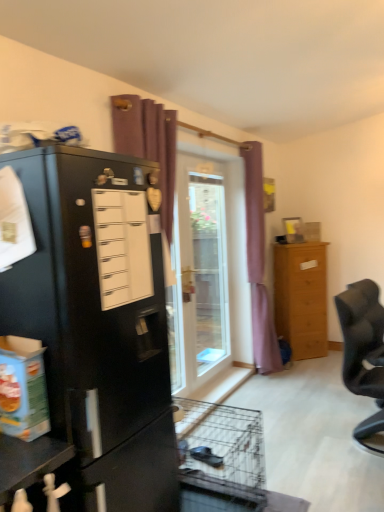
This screenshot has width=384, height=512. I want to click on light brown wooden chest of drawers at right, so click(301, 297).

Find the location of a particular element. transparent glass door at center is located at coordinates (199, 274).

The height and width of the screenshot is (512, 384). Describe the element at coordinates (122, 247) in the screenshot. I see `white matte drawer at left` at that location.

Find the location of a particular element. This screenshot has width=384, height=512. black fabric chair at right is located at coordinates (363, 351).

Describe the element at coordinates (149, 144) in the screenshot. The height and width of the screenshot is (512, 384). I see `purple fabric curtain at upper center, the second curtain when ordered from back to front` at that location.

You are a GUI agent. You are given a task and a screenshot of the screen. Output one action in this format:
    pyautogui.click(x=<x>, y=<y>)
    Task: Click on the light brown wooden chest of drawers at right
    The width and height of the screenshot is (384, 512).
    Given the screenshot: What is the action you would take?
    pyautogui.click(x=301, y=297)

I want to click on drawer in front of the black fabric chair at right, so click(122, 247).

Considering the sizes of objects white matte drawer at left and black fabric chair at right in the image provided, who is smaller, white matte drawer at left or black fabric chair at right?

white matte drawer at left.

Is white matte drawer at left inside the boundaries of black fabric chair at right, or outside?

white matte drawer at left cannot be found inside black fabric chair at right.

Between white matte drawer at left and black fabric chair at right, which one has smaller width?

white matte drawer at left is thinner.

Would you say black fabric chair at right is a long distance from white matte drawer at left?

black fabric chair at right is far away from white matte drawer at left.

Considering the relative sizes of black fabric chair at right and white matte drawer at left in the image provided, is black fabric chair at right thinner than white matte drawer at left?

No.

From the image's perspective, is black fabric chair at right located above or below white matte drawer at left?

Clearly, from the image's perspective, black fabric chair at right is below white matte drawer at left.

Who is shorter, purple fabric curtain at upper center, the 1th curtain when ordered from front to back, or black matte refrigerator at left?

black matte refrigerator at left is shorter.

Who is more distant, purple fabric curtain at upper center, the 1th curtain when ordered from front to back, or black matte refrigerator at left?

purple fabric curtain at upper center, the 1th curtain when ordered from front to back, is more distant.

From the picture: Which of these two, purple fabric curtain at upper center, the 1th curtain when ordered from front to back, or black matte refrigerator at left, is smaller?

purple fabric curtain at upper center, the 1th curtain when ordered from front to back, is smaller.

Would you say purple fabric curtain at upper center, the 1th curtain when ordered from front to back, is to the left or to the right of black fabric chair at right in the picture?

Clearly, purple fabric curtain at upper center, the 1th curtain when ordered from front to back, is on the left of black fabric chair at right in the image.

Is black fabric chair at right inside purple fabric curtain at upper center, marked as the second curtain in a right-to-left arrangement?

That's incorrect, black fabric chair at right is not inside purple fabric curtain at upper center, marked as the second curtain in a right-to-left arrangement.

Which object is further away from the camera, purple fabric curtain at upper center, which is the first curtain from left to right, or black fabric chair at right?

black fabric chair at right is behind.

From the image's perspective, starting from the black fabric chair at right, which curtain is the 1st one above? Please provide its 2D coordinates.

[(149, 144)]

Where is `cupboard lying in front of the transparent glass door at center`? cupboard lying in front of the transparent glass door at center is located at coordinates (99, 321).

Is transparent glass door at center located outside black matte refrigerator at left?

That's correct, transparent glass door at center is outside of black matte refrigerator at left.

From a real-world perspective, is transparent glass door at center over black matte refrigerator at left?

Yes, from a real-world perspective, transparent glass door at center is above black matte refrigerator at left.

Looking at their sizes, would you say transparent glass door at center is wider or thinner than black matte refrigerator at left?

Considering their sizes, transparent glass door at center looks slimmer than black matte refrigerator at left.

From the image's perspective, does purple fabric curtain at upper center, which is the first curtain from left to right, appear lower than light brown wooden chest of drawers at right?

Actually, purple fabric curtain at upper center, which is the first curtain from left to right, appears above light brown wooden chest of drawers at right in the image.

How different are the orientations of purple fabric curtain at upper center, the 1th curtain when ordered from front to back, and light brown wooden chest of drawers at right in degrees?

The angular difference between purple fabric curtain at upper center, the 1th curtain when ordered from front to back, and light brown wooden chest of drawers at right is 47.1 degrees.

Is point (170, 331) closer to viewer compared to point (292, 307)?

Yes, point (170, 331) is closer to viewer.

Is purple fabric curtain at upper center, the 1th curtain when ordered from front to back, oriented away from light brown wooden chest of drawers at right?

No, purple fabric curtain at upper center, the 1th curtain when ordered from front to back, is not facing away from light brown wooden chest of drawers at right.

Is black matte refrigerator at left facing towards transparent glass door at center?

No, black matte refrigerator at left is not aimed at transparent glass door at center.

Locate an element on the screen. door that appears above the black matte refrigerator at left (from a real-world perspective) is located at coordinates (199, 274).

In the scene shown: From the image's perspective, would you say black matte refrigerator at left is shown under transparent glass door at center?

Indeed, from the image's perspective, black matte refrigerator at left is shown beneath transparent glass door at center.

This screenshot has height=512, width=384. What are the coordinates of `drawer above the black fabric chair at right (from the image's perspective)` in the screenshot? It's located at (122, 247).

Identify the location of drawer above the black fabric chair at right (from a real-world perspective). (122, 247).

When comparing their distances from light brown wooden chest of drawers at right, does black fabric chair at right or white matte drawer at left seem closer?

The object closer to light brown wooden chest of drawers at right is black fabric chair at right.

Looking at the image, which one is located further to light brown wooden chest of drawers at right, white matte drawer at left or purple fabric curtain at center, which is the first curtain in back-to-front order?

Based on the image, white matte drawer at left appears to be further to light brown wooden chest of drawers at right.

Which object lies nearer to the anchor point black fabric chair at right, black matte refrigerator at left or purple fabric curtain at upper center, the 1th curtain when ordered from front to back?

The object closer to black fabric chair at right is purple fabric curtain at upper center, the 1th curtain when ordered from front to back.

Estimate the real-world distances between objects in this image. Which object is further from purple fabric curtain at upper center, the second curtain when ordered from back to front, white matte drawer at left or purple fabric curtain at center, marked as the second curtain in a left-to-right arrangement?

The object further to purple fabric curtain at upper center, the second curtain when ordered from back to front, is purple fabric curtain at center, marked as the second curtain in a left-to-right arrangement.

When comparing their distances from light brown wooden chest of drawers at right, does black fabric chair at right or purple fabric curtain at upper center, marked as the second curtain in a right-to-left arrangement, seem closer?

The object closer to light brown wooden chest of drawers at right is black fabric chair at right.

Estimate the real-world distances between objects in this image. Which object is further from black fabric chair at right, light brown wooden chest of drawers at right or white matte drawer at left?

Among the two, white matte drawer at left is located further to black fabric chair at right.

Looking at the image, which one is located further to purple fabric curtain at upper center, the 1th curtain when ordered from front to back, white matte drawer at left or light brown wooden chest of drawers at right?

The object further to purple fabric curtain at upper center, the 1th curtain when ordered from front to back, is light brown wooden chest of drawers at right.

Which object lies further to the anchor point light brown wooden chest of drawers at right, black matte refrigerator at left or black fabric chair at right?

Among the two, black matte refrigerator at left is located further to light brown wooden chest of drawers at right.

Image resolution: width=384 pixels, height=512 pixels. I want to click on chest of drawers between transparent glass door at center and black fabric chair at right from left to right, so click(301, 297).

Where is `drawer between black matte refrigerator at left and light brown wooden chest of drawers at right from front to back`? This screenshot has width=384, height=512. drawer between black matte refrigerator at left and light brown wooden chest of drawers at right from front to back is located at coordinates (122, 247).

This screenshot has width=384, height=512. Identify the location of chair between purple fabric curtain at upper center, the second curtain when ordered from back to front, and light brown wooden chest of drawers at right, along the z-axis. (363, 351).

In order to click on curtain between transparent glass door at center and light brown wooden chest of drawers at right from left to right in this screenshot , I will do `click(258, 263)`.